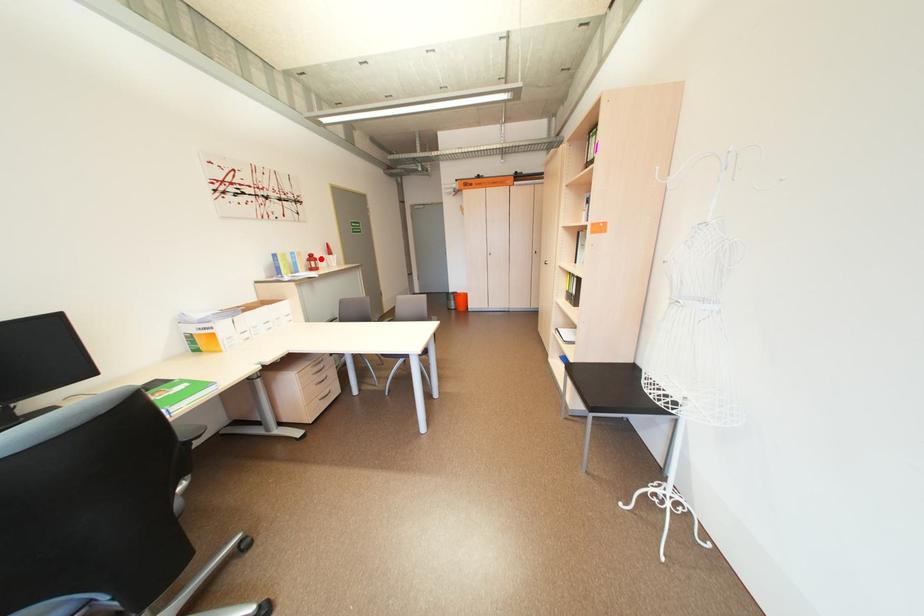
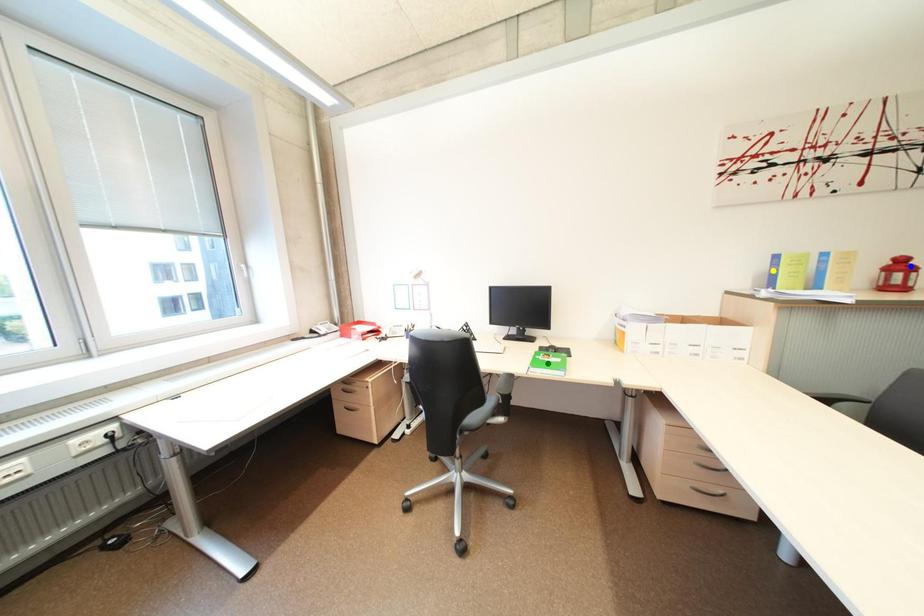
Question: I am providing you with two images of the same scene from different viewpoints. A red point is marked on the first image. You are given multiple points on the second image. In image 2, which mark is for the same physical point as the one in image 1?

Choices:
 (A) green point
 (B) yellow point
 (C) blue point

Answer: (C)